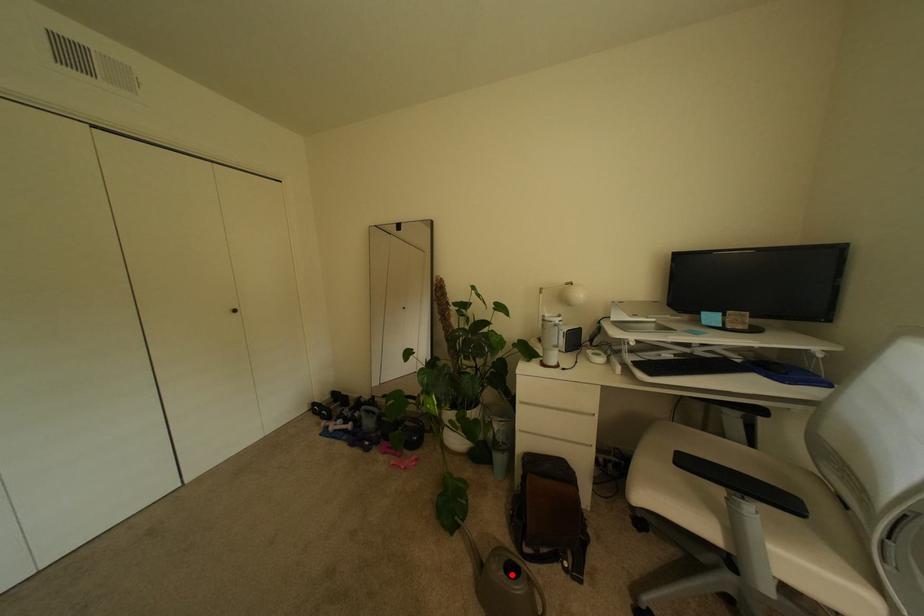
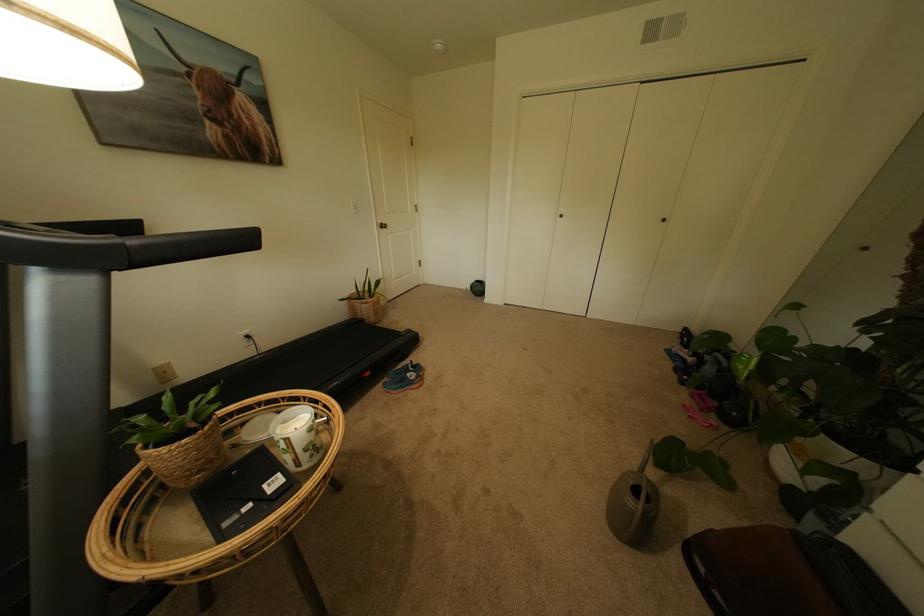
In the second image, find the point that corresponds to the highlighted location in the first image.

(639, 484)